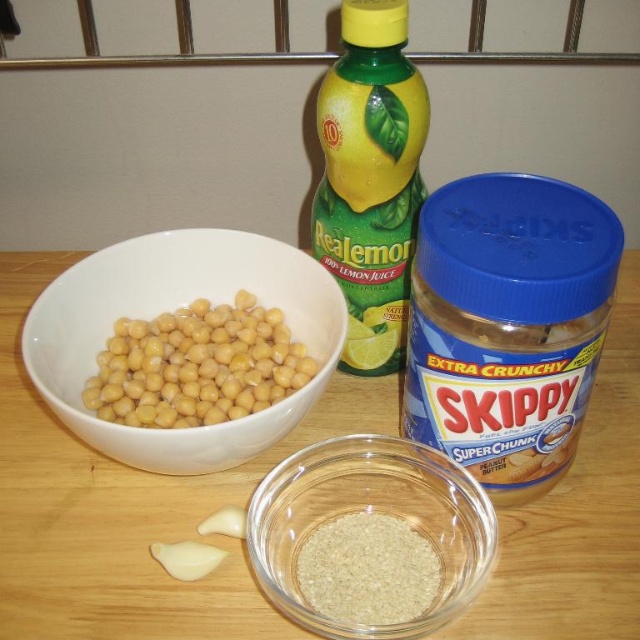
You are preparing a recipe and need to choose between the transparent glass bowl at lower center and the transparent glass bowl at center. Which bowl has a larger capacity?

The transparent glass bowl at lower center has a larger capacity than the transparent glass bowl at center because it is bigger in size.

You are preparing a recipe and need to pour the contents of the transparent glass bowl at center into the yellow matte chickpeas at left. Will the bowl fit entirely inside the chickpeas container?

The transparent glass bowl at center has a smaller size compared to yellow matte chickpeas at left, so it can fit entirely inside the chickpeas container.

What object is located at the coordinates point (172,308)?

The point (172,308) corresponds to the white ceramic bowl at left.